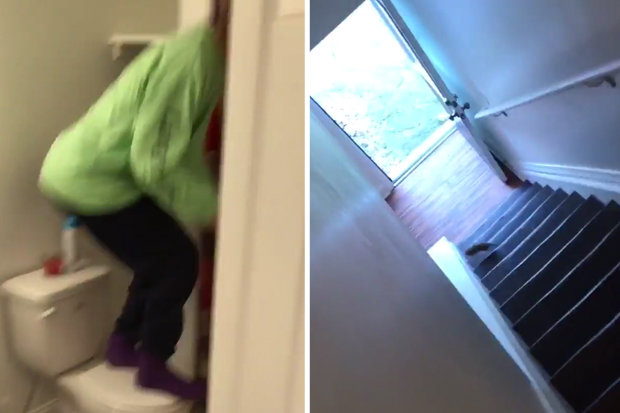
In order to click on wall in this screenshot , I will do `click(56, 71)`.